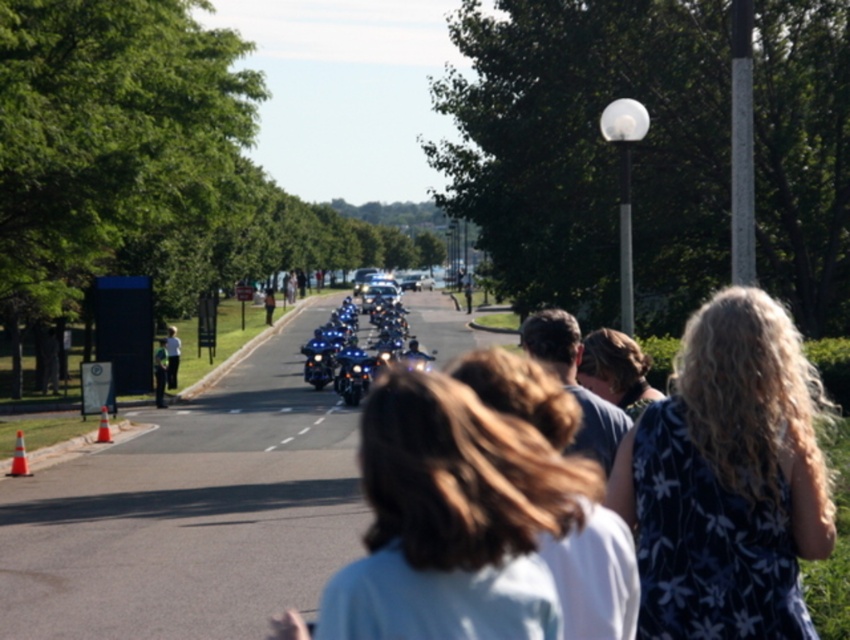
Does shiny chrome motorcycle at center have a smaller size compared to white dashed line at center?

No.

Which is behind, point (326, 355) or point (335, 406)?

The point (326, 355) is behind.

The image size is (850, 640). In order to click on shiny chrome motorcycle at center in this screenshot , I will do `click(316, 362)`.

What are the coordinates of `shiny chrome motorcycle at center` in the screenshot? It's located at pyautogui.click(x=316, y=362).

Measure the distance between dark floral dress at center and camera.

dark floral dress at center is 3.81 meters from camera.

Is point (783, 534) positioned after point (299, 435)?

No, it is in front of (299, 435).

What do you see at coordinates (728, 480) in the screenshot?
I see `dark floral dress at center` at bounding box center [728, 480].

What are the coordinates of `dark floral dress at center` in the screenshot? It's located at (728, 480).

Which is behind, point (717, 433) or point (337, 362)?

The point (337, 362) is behind.

Between point (814, 378) and point (350, 385), which one is positioned behind?

Positioned behind is point (350, 385).

I want to click on dark floral dress at center, so click(x=728, y=480).